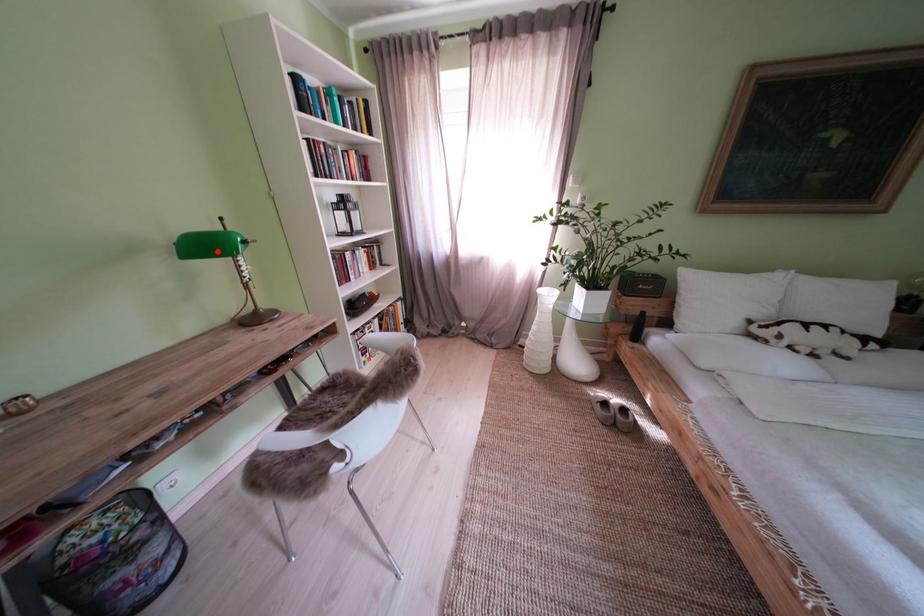
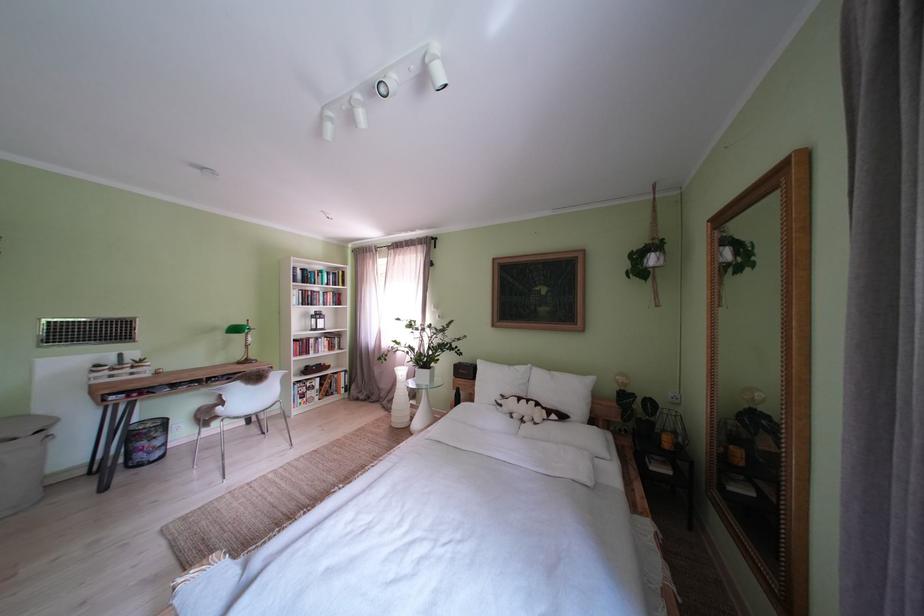
Where in the second image is the point corresponding to the highlighted location from the first image?

(247, 334)